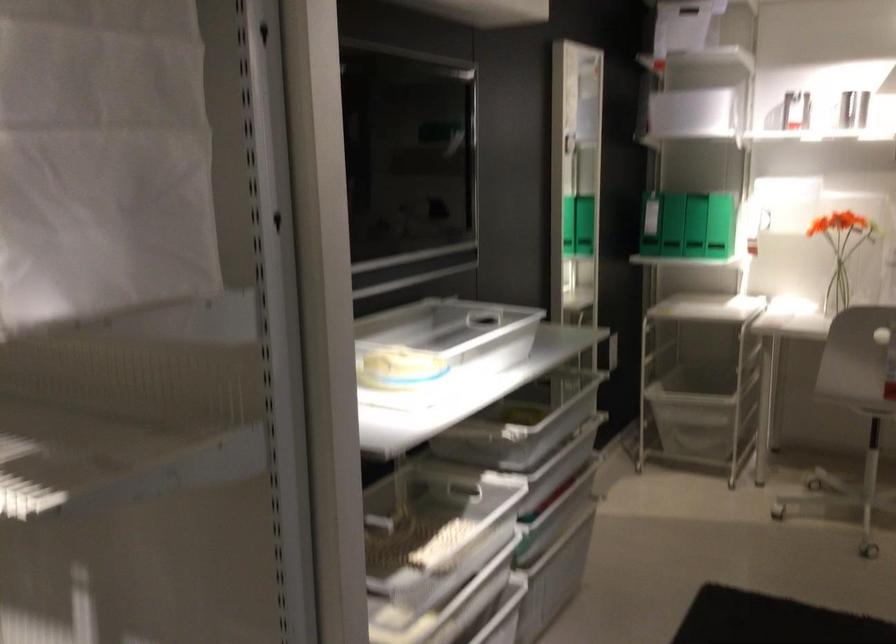
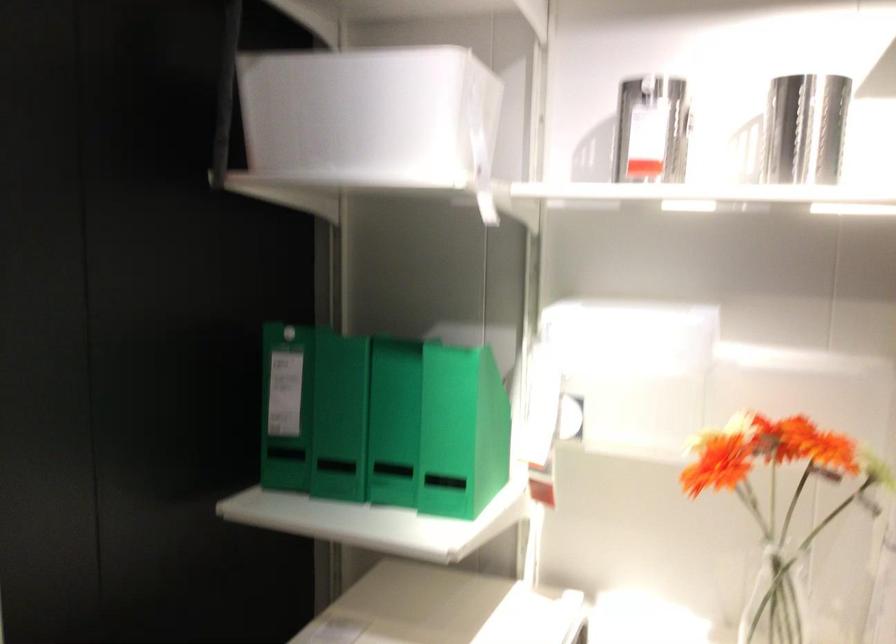
In a continuous first-person perspective shot, in which direction is the camera moving?

The movement direction of the cameraman is right, forward.